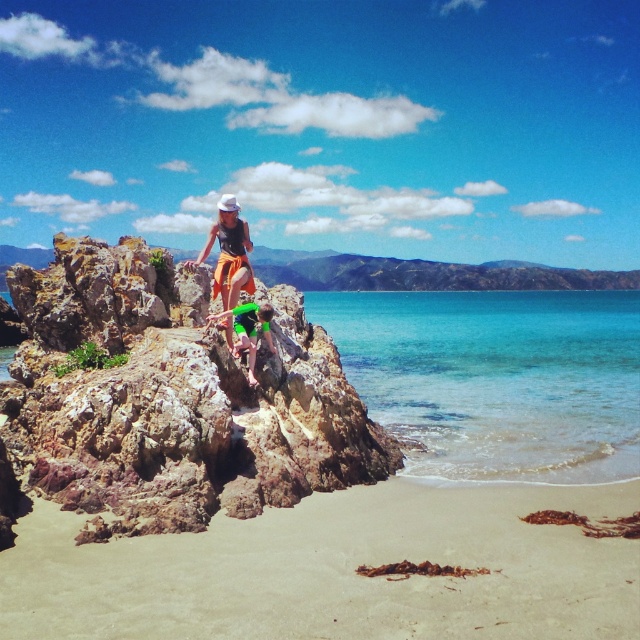
Question: Is clear blue water at lower right wider than matte orange shorts at center?

Choices:
 (A) no
 (B) yes

Answer: (B)

Question: Which object is farther from the camera taking this photo?

Choices:
 (A) rusty rock at center
 (B) clear blue water at lower right
 (C) smooth sand beach at lower center
 (D) green fabric shorts at center

Answer: (B)

Question: Which is farther from the rusty rock at center?

Choices:
 (A) smooth sand beach at lower center
 (B) clear blue water at lower right
 (C) green fabric shorts at center

Answer: (B)

Question: Among these points, which one is nearest to the camera?

Choices:
 (A) (540, 621)
 (B) (253, 317)
 (C) (112, 269)
 (D) (518, 294)

Answer: (A)

Question: Does matte orange shorts at center have a greater width compared to green fabric shorts at center?

Choices:
 (A) yes
 (B) no

Answer: (A)

Question: From the image, what is the correct spatial relationship of rusty rock at center in relation to matte orange shorts at center?

Choices:
 (A) right
 (B) left

Answer: (A)